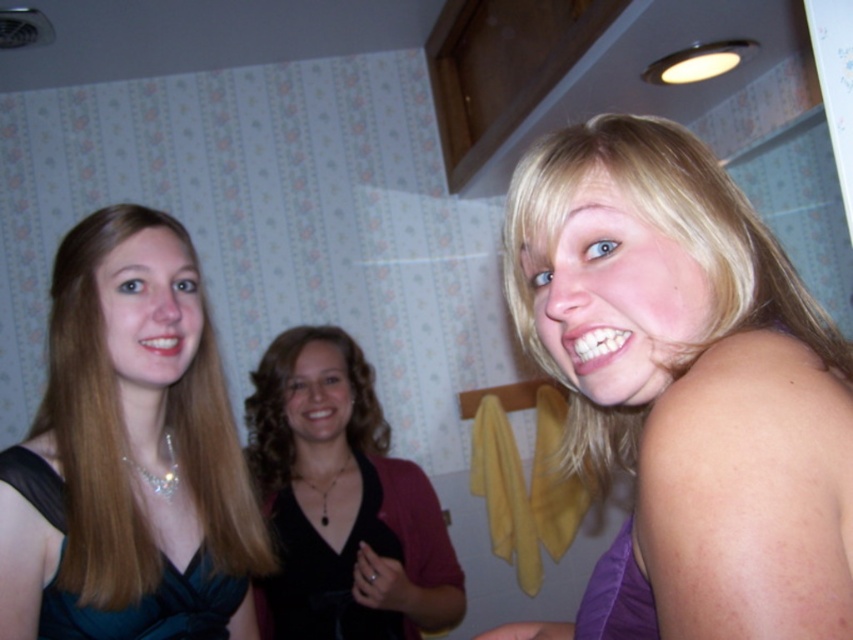
Question: Is teal satin dress at left closer to the viewer compared to black satin dress at center?

Choices:
 (A) no
 (B) yes

Answer: (B)

Question: Considering the relative positions of black velvet blazer at center and black satin dress at center in the image provided, where is black velvet blazer at center located with respect to black satin dress at center?

Choices:
 (A) below
 (B) above

Answer: (B)

Question: Among these objects, which one is nearest to the camera?

Choices:
 (A) black satin dress at center
 (B) black velvet blazer at center
 (C) matte black dress at center

Answer: (C)

Question: Which of the following is the closest to the observer?

Choices:
 (A) black satin dress at center
 (B) black velvet blazer at center
 (C) satin black dress at left

Answer: (C)

Question: In this image, where is teal satin dress at left located relative to satin black dress at left?

Choices:
 (A) left
 (B) right

Answer: (B)

Question: Which point appears farthest from the camera in this image?

Choices:
 (A) pos(67,628)
 (B) pos(131,481)

Answer: (B)